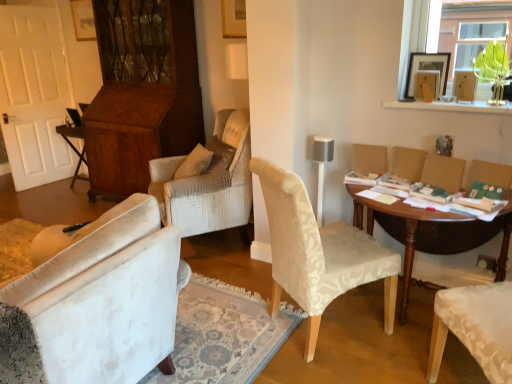
Question: Does transparent glass vase at upper right appear on the left side of matte beige armchair at right, which is counted as the second armchair, starting from the right?

Choices:
 (A) yes
 (B) no

Answer: (B)

Question: From the image's perspective, is transparent glass vase at upper right beneath matte beige armchair at right, which is the 2th armchair in left-to-right order?

Choices:
 (A) no
 (B) yes

Answer: (A)

Question: Is the depth of transparent glass vase at upper right less than that of matte beige armchair at right, which is the 2th armchair in left-to-right order?

Choices:
 (A) no
 (B) yes

Answer: (B)

Question: Is matte beige armchair at right, which is counted as the second armchair, starting from the right, located within transparent glass vase at upper right?

Choices:
 (A) yes
 (B) no

Answer: (B)

Question: Considering the relative sizes of transparent glass vase at upper right and matte beige armchair at right, which is the 2th armchair in left-to-right order, in the image provided, is transparent glass vase at upper right taller than matte beige armchair at right, which is the 2th armchair in left-to-right order,?

Choices:
 (A) yes
 (B) no

Answer: (A)

Question: Relative to matte beige armchair at right, which is the 2th armchair in left-to-right order, is light beige fabric chair at center in front or behind?

Choices:
 (A) front
 (B) behind

Answer: (A)

Question: Is light beige fabric chair at center taller or shorter than matte beige armchair at right, which is counted as the second armchair, starting from the right?

Choices:
 (A) tall
 (B) short

Answer: (A)

Question: In the image, is light beige fabric chair at center on the left side or the right side of matte beige armchair at right, which is counted as the second armchair, starting from the right?

Choices:
 (A) right
 (B) left

Answer: (B)

Question: From the image's perspective, relative to matte beige armchair at right, which is the 2th armchair in left-to-right order, is light beige fabric chair at center above or below?

Choices:
 (A) below
 (B) above

Answer: (A)

Question: Choose the correct answer: Is wooden folding table at left, which appears as the 1th table when viewed from the back, inside matte beige armchair at right, marked as the 3th armchair in a right-to-left arrangement, or outside it?

Choices:
 (A) outside
 (B) inside

Answer: (A)

Question: From the image's perspective, is wooden folding table at left, placed as the second table when sorted from right to left, located above or below matte beige armchair at right, placed as the 1th armchair when sorted from left to right?

Choices:
 (A) below
 (B) above

Answer: (B)

Question: Is wooden folding table at left, which appears as the 1th table when viewed from the back, bigger or smaller than matte beige armchair at right, placed as the 1th armchair when sorted from left to right?

Choices:
 (A) small
 (B) big

Answer: (B)

Question: Is wooden folding table at left, positioned as the second table in front-to-back order, wider or thinner than matte beige armchair at right, marked as the 3th armchair in a right-to-left arrangement?

Choices:
 (A) thin
 (B) wide

Answer: (B)

Question: Relative to transparent glass vase at upper right, is wooden folding table at left, placed as the second table when sorted from right to left, in front or behind?

Choices:
 (A) behind
 (B) front

Answer: (A)

Question: Is point (78, 135) positioned closer to the camera than point (459, 41)?

Choices:
 (A) farther
 (B) closer

Answer: (B)